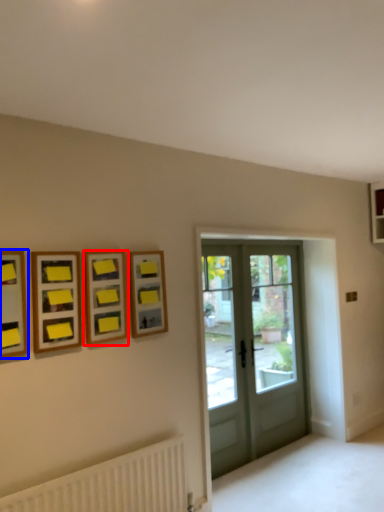
Question: Which of the following is the farthest to the observer, picture frame (highlighted by a red box) or picture frame (highlighted by a blue box)?

Choices:
 (A) picture frame
 (B) picture frame

Answer: (A)